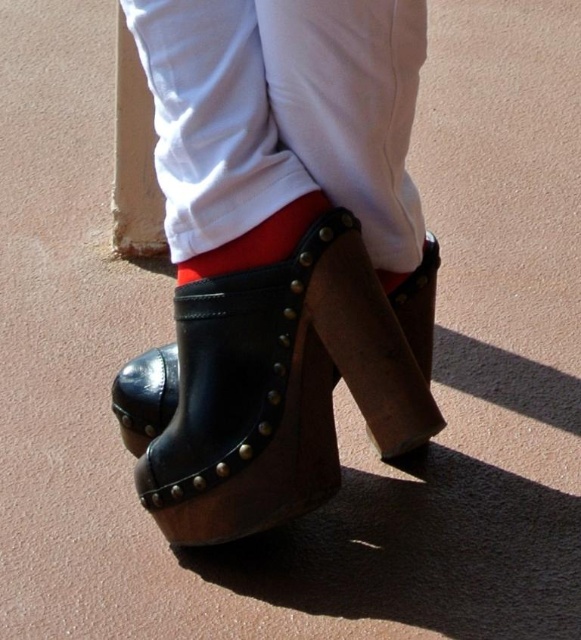
You are a fashion designer examining a model wearing the described footwear and attire. You need to determine the layering order of the black leather sandal at center and the red leather sock at center. Which item is placed above the other?

The red leather sock at center is placed above the black leather sandal at center since the sandal is positioned under the sock.

From the picture: Where is the black leather sandal at center located in the image?

The black leather sandal at center is located at point (278, 385) in the image.

You are trying to decide between wearing the black leather sandal at center and the red leather sock at center. Which one has a wider base?

The black leather sandal at center might be wider than the red leather sock at center, so the black leather sandal at center has a wider base.